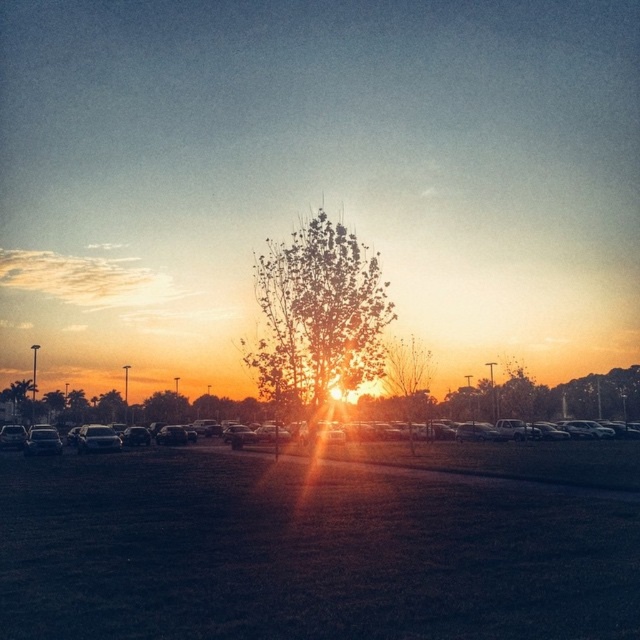
You are standing in the parking lot and want to take a photo of the sunset with the green leafy tree at center in the background. If your camera has a maximum focus distance of 80 feet, will you be able to capture the tree clearly in your photo?

The green leafy tree at center is 80.55 feet away from the camera. Since the camera can only focus up to 80 feet, it won not be able to capture the tree clearly.

You are a photographer trying to capture the sunset through the gap between the green leafy tree at center and the metallic cars at center. Which object is narrower so that you can frame the sunset better?

The green leafy tree at center has a lesser width compared to metallic cars at center, so it is narrower and better for framing the sunset.

You are a photographer standing in the parking lot and want to capture the sunset with both the green leafy tree at center and the metallic cars at center in the same frame. Given that your camera has a maximum focal length of 50 meters, will you be able to include both objects in the photo?

The distance between the green leafy tree at center and the metallic cars at center is 20.13 meters, which is within the camera maximum focal length of 50 meters. Therefore, you can include both objects in the same frame.